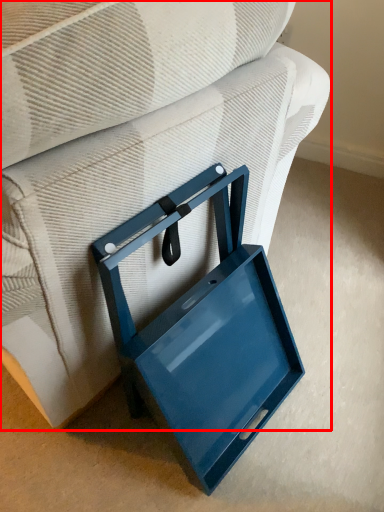
Question: From the image's perspective, where is furniture (annotated by the red box) located relative to lunch box?

Choices:
 (A) below
 (B) above

Answer: (B)